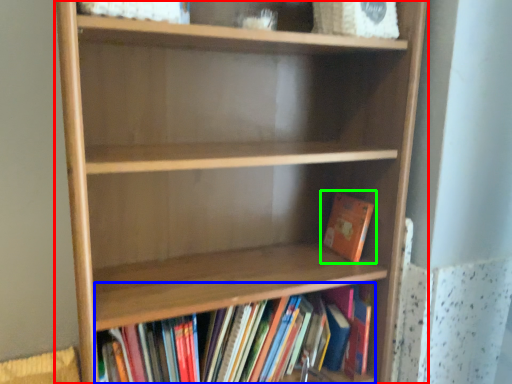
Question: Which object is the farthest from shelf (highlighted by a red box)? Choose among these: book (highlighted by a blue box) or book (highlighted by a green box).

Choices:
 (A) book
 (B) book

Answer: (B)